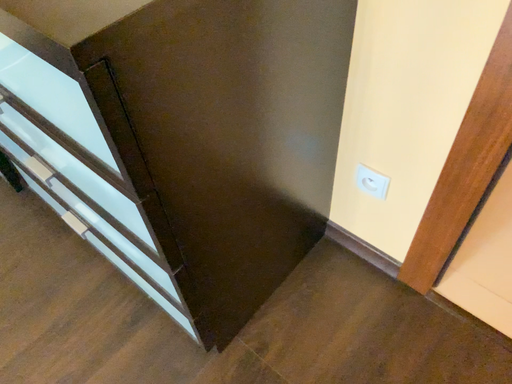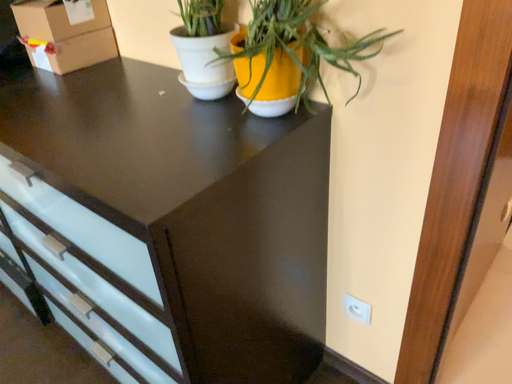
Question: Which way did the camera rotate in the video?

Choices:
 (A) rotated downward
 (B) rotated upward

Answer: (B)